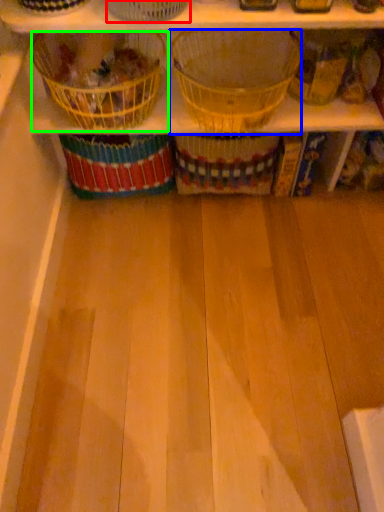
Question: Which object is positioned closest to basket (highlighted by a red box)? Select from basket (highlighted by a blue box) and basket (highlighted by a green box).

Choices:
 (A) basket
 (B) basket

Answer: (B)